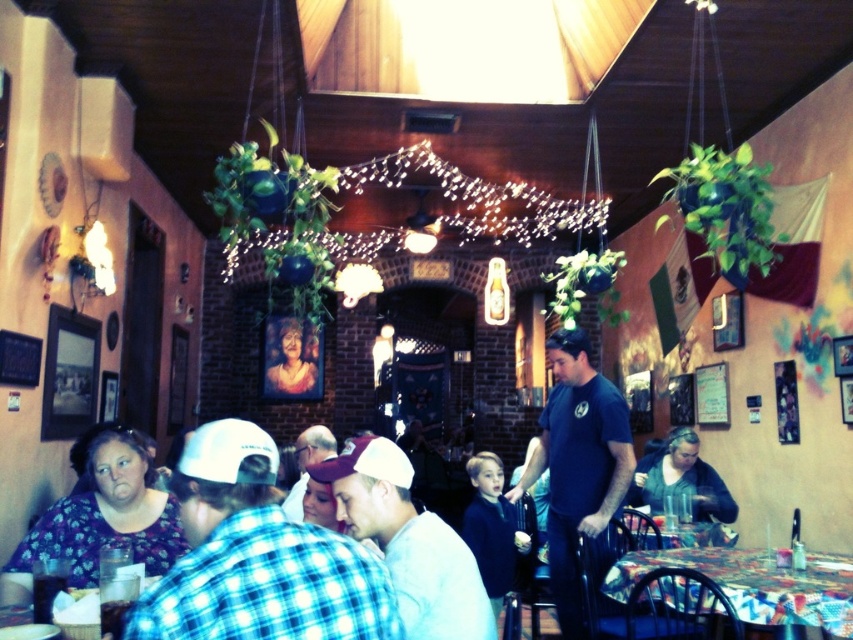
You are a customer sitting at a table in the restaurant and notice two items of clothing nearby. The checkered fabric shirt at center and the dark green sweater at lower right. Which one is positioned higher up in the scene?

The checkered fabric shirt at center is positioned higher up because it is above the dark green sweater at lower right.